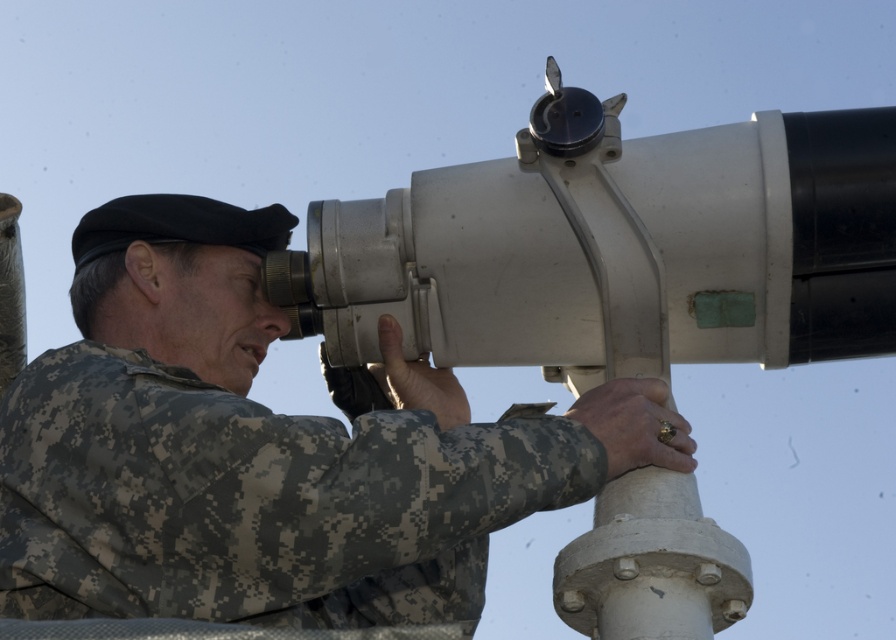
You are a soldier in the field and need to locate your binoculars. You remember they were placed at point (265, 451). Based on the scene description, where would you find the matte gray binoculars at center?

The matte gray binoculars at center are located at point (265, 451).

You are a photographer trying to capture a clear image of the telescope in the scene. You notice two points marked in the image at coordinates point (73, 314) and point (882, 264). Which of these points is closer to your camera lens?

Point (882, 264) is closer to the camera lens because it is less further than point (73, 314) according to the description.